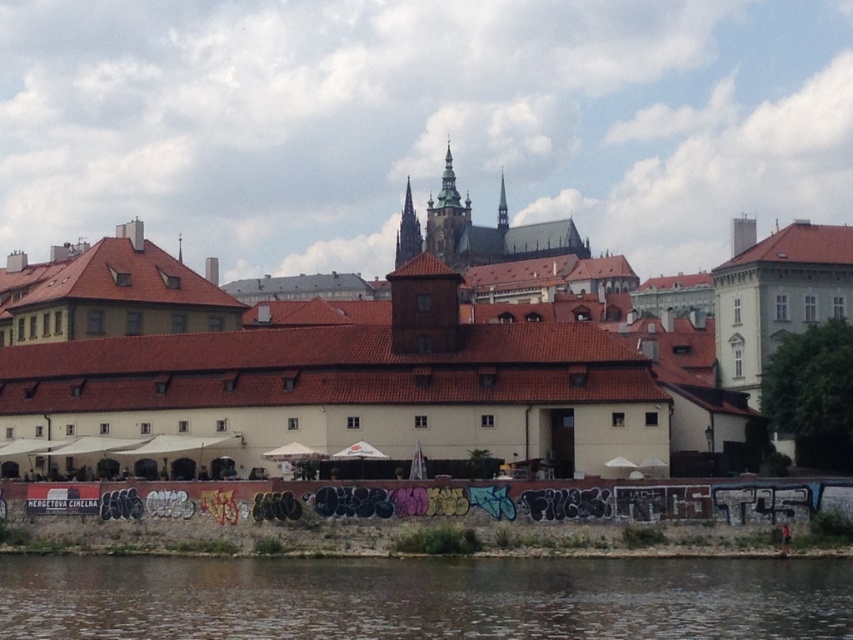
Question: Which point is closer to the camera?

Choices:
 (A) (73, 513)
 (B) (547, 353)
 (C) (161, 561)

Answer: (C)

Question: Which point appears closest to the camera in this image?

Choices:
 (A) (700, 611)
 (B) (506, 410)
 (C) (544, 486)

Answer: (A)

Question: Does white matte building at center appear on the left side of brown water at lower center?

Choices:
 (A) yes
 (B) no

Answer: (B)

Question: Does white matte building at center come in front of concrete wall with graffiti at lower center?

Choices:
 (A) no
 (B) yes

Answer: (A)

Question: Can you confirm if white matte building at center is positioned to the right of concrete wall with graffiti at lower center?

Choices:
 (A) no
 (B) yes

Answer: (B)

Question: Among these points, which one is nearest to the camera?

Choices:
 (A) (524, 621)
 (B) (537, 368)
 (C) (204, 492)

Answer: (A)